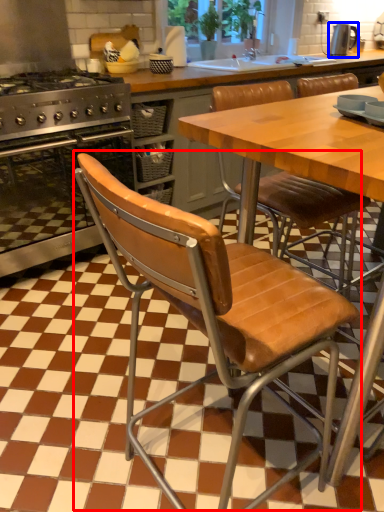
Question: Among these objects, which one is farthest to the camera, chair (highlighted by a red box) or kitchen appliance (highlighted by a blue box)?

Choices:
 (A) chair
 (B) kitchen appliance

Answer: (B)